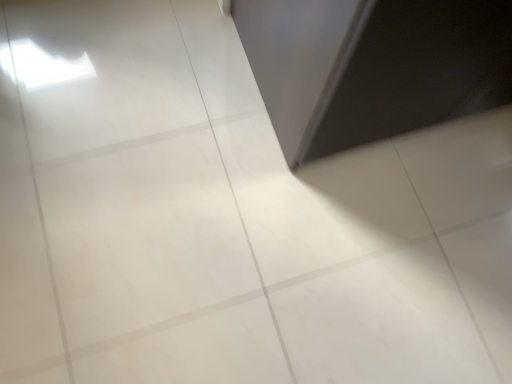
You are a GUI agent. You are given a task and a screenshot of the screen. Output one action in this format:
    pyautogui.click(x=<x>, y=<y>)
    Task: Click on the matte gray door at upper right
    The height and width of the screenshot is (384, 512).
    Given the screenshot: What is the action you would take?
    pyautogui.click(x=373, y=66)

Describe the element at coordinates (373, 66) in the screenshot. Image resolution: width=512 pixels, height=384 pixels. I see `matte gray door at upper right` at that location.

This screenshot has height=384, width=512. What are the coordinates of `matte gray door at upper right` in the screenshot? It's located at (373, 66).